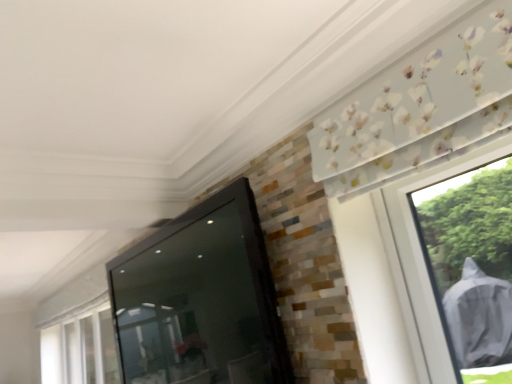
Question: Considering their positions, is black glossy screen door at center located in front of or behind transparent plastic window at lower left?

Choices:
 (A) behind
 (B) front

Answer: (B)

Question: Considering the relative positions of black glossy screen door at center and transparent plastic window at lower left in the image provided, is black glossy screen door at center to the left or to the right of transparent plastic window at lower left?

Choices:
 (A) left
 (B) right

Answer: (B)

Question: Considering the positions of black glossy screen door at center and transparent plastic window at lower left in the image, is black glossy screen door at center wider or thinner than transparent plastic window at lower left?

Choices:
 (A) wide
 (B) thin

Answer: (A)

Question: Considering the positions of transparent plastic window at lower left and black glossy screen door at center in the image, is transparent plastic window at lower left wider or thinner than black glossy screen door at center?

Choices:
 (A) thin
 (B) wide

Answer: (A)

Question: From the image's perspective, is transparent plastic window at lower left positioned above or below black glossy screen door at center?

Choices:
 (A) below
 (B) above

Answer: (A)

Question: In terms of size, does transparent plastic window at lower left appear bigger or smaller than black glossy screen door at center?

Choices:
 (A) small
 (B) big

Answer: (A)

Question: Is point (59, 326) closer or farther from the camera than point (237, 370)?

Choices:
 (A) closer
 (B) farther

Answer: (B)